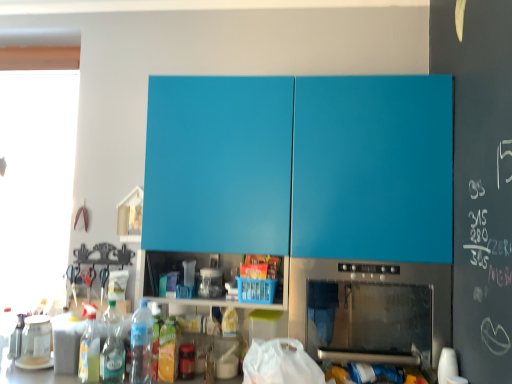
Question: Considering the positions of transparent glass jar at lower left, which is counted as the 1th appliance, starting from the left, and matte blue cabinet at upper center in the image, is transparent glass jar at lower left, which is counted as the 1th appliance, starting from the left, bigger or smaller than matte blue cabinet at upper center?

Choices:
 (A) big
 (B) small

Answer: (B)

Question: From a real-world perspective, is transparent glass jar at lower left, which is counted as the 1th appliance, starting from the left, physically located above or below matte blue cabinet at upper center?

Choices:
 (A) above
 (B) below

Answer: (B)

Question: Estimate the real-world distances between objects in this image. Which object is farther from the translucent plastic bottle at lower left, positioned as the third bottle in left-to-right order?

Choices:
 (A) transparent plastic jar at center, which ranks as the 1th appliance in right-to-left order
 (B) translucent plastic bottle at lower left, the third bottle viewed from the right
 (C) stainless steel oven at lower center
 (D) clear plastic bottle at lower left, positioned as the second bottle in left-to-right order
 (E) matte blue cabinet at upper center

Answer: (E)

Question: Based on their relative distances, which object is nearer to the stainless steel oven at lower center?

Choices:
 (A) clear plastic bottle at lower left, positioned as the second bottle in left-to-right order
 (B) matte blue cabinet at upper center
 (C) transparent glass jar at lower left, the second appliance when ordered from right to left
 (D) translucent plastic bottle at lower left, which is the 1th bottle from left to right
 (E) translucent plastic bottle at lower left, arranged as the first bottle when viewed from the right

Answer: (B)